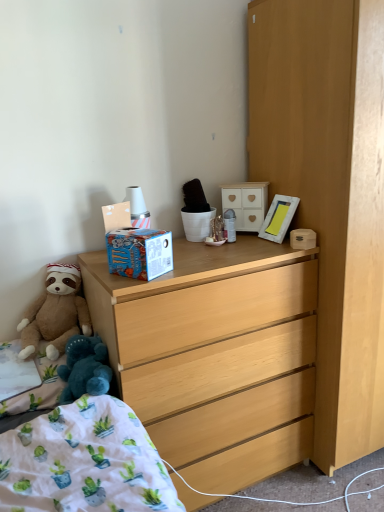
Locate an element on the screen. This screenshot has width=384, height=512. unoccupied area in front of white painted wood cabinet at upper center, which ranks as the 1th cabinetry in top-to-bottom order is located at coordinates (249, 245).